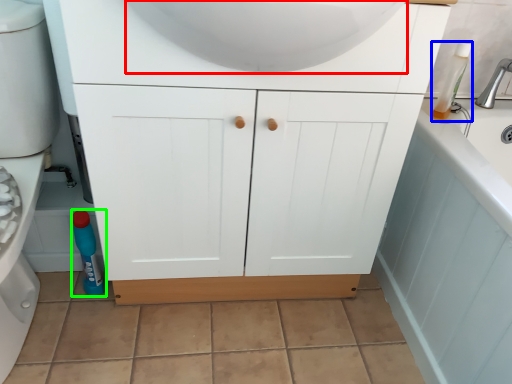
Question: Based on their relative distances, which object is farther from sink (highlighted by a red box)? Choose from cleaning product (highlighted by a blue box) and bottle (highlighted by a green box).

Choices:
 (A) cleaning product
 (B) bottle

Answer: (B)